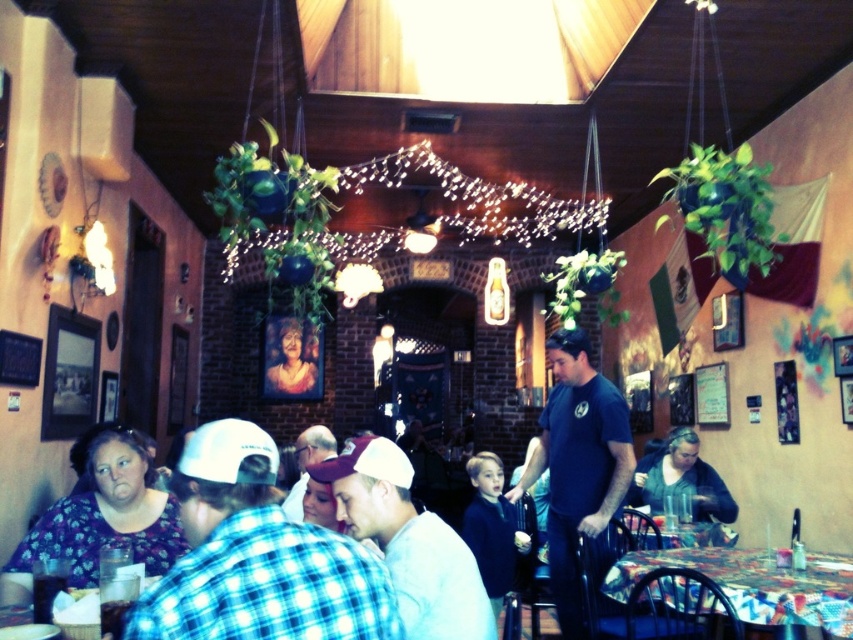
Does floral-patterned blouse at lower left have a greater height compared to dark green sweater at lower right?

Incorrect, floral-patterned blouse at lower left's height is not larger of dark green sweater at lower right's.

Can you confirm if floral-patterned blouse at lower left is positioned below dark green sweater at lower right?

No, floral-patterned blouse at lower left is not below dark green sweater at lower right.

Is point (25, 556) farther from camera compared to point (648, 465)?

No, (25, 556) is closer to viewer.

You are a GUI agent. You are given a task and a screenshot of the screen. Output one action in this format:
    pyautogui.click(x=<x>, y=<y>)
    Task: Click on the floral-patterned blouse at lower left
    The height and width of the screenshot is (640, 853).
    Given the screenshot: What is the action you would take?
    pyautogui.click(x=100, y=520)

Does floral-patterned blouse at lower left have a smaller size compared to dark blue sweater at center?

Yes, floral-patterned blouse at lower left is smaller than dark blue sweater at center.

Does point (157, 504) come behind point (469, 515)?

No, (157, 504) is in front of (469, 515).

What are the coordinates of `floral-patterned blouse at lower left` in the screenshot? It's located at (100, 520).

Which is more to the right, white matte cap at center or floral-patterned blouse at lower left?

Positioned to the right is white matte cap at center.

Who is lower down, white matte cap at center or floral-patterned blouse at lower left?

floral-patterned blouse at lower left is below.

Is point (428, 544) closer to viewer compared to point (96, 476)?

Yes, it is.

Locate an element on the screen. The width and height of the screenshot is (853, 640). white matte cap at center is located at coordinates 408,541.